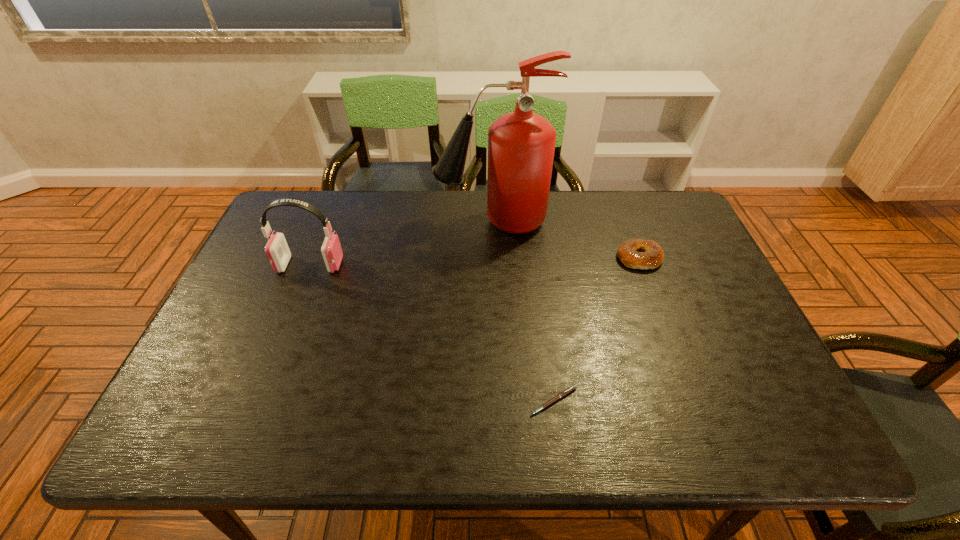
You are a GUI agent. You are given a task and a screenshot of the screen. Output one action in this format:
    pyautogui.click(x=<x>, y=<y>)
    Task: Click on the vacant space at the right edge of the desktop
    This screenshot has height=540, width=960.
    Given the screenshot: What is the action you would take?
    pyautogui.click(x=677, y=254)

Where is `vacant space at the far left corner of the desktop`? vacant space at the far left corner of the desktop is located at coordinates (288, 194).

Where is `vacant position at the far right corner of the desktop`? This screenshot has width=960, height=540. vacant position at the far right corner of the desktop is located at coordinates (657, 226).

Find the location of a particular element. This screenshot has height=540, width=960. blank region between the fire extinguisher and the rightmost object is located at coordinates (566, 240).

Where is `vacant area between the third shortest object and the rightmost object`? Image resolution: width=960 pixels, height=540 pixels. vacant area between the third shortest object and the rightmost object is located at coordinates (475, 261).

Find the location of a particular element. The width and height of the screenshot is (960, 540). vacant space in between the rightmost object and the tallest object is located at coordinates (566, 240).

You are a GUI agent. You are given a task and a screenshot of the screen. Output one action in this format:
    pyautogui.click(x=<x>, y=<y>)
    Task: Click on the free space between the third shortest object and the farthest object
    This screenshot has width=960, height=540.
    Given the screenshot: What is the action you would take?
    pyautogui.click(x=401, y=243)

Locate an element on the screen. vacant area between the earphone and the shortest object is located at coordinates (432, 333).

Image resolution: width=960 pixels, height=540 pixels. Identify the location of vacant region between the nearest object and the earphone. (432, 333).

Locate an element on the screen. free space between the nearest object and the farthest object is located at coordinates (523, 311).